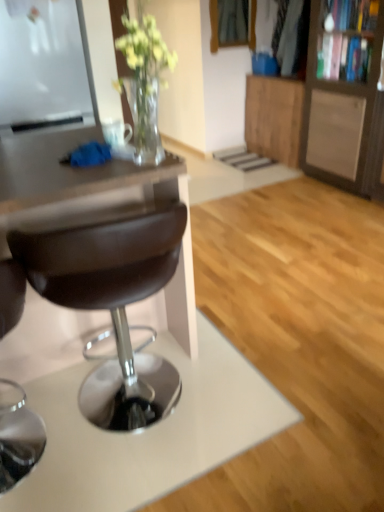
Question: Can you confirm if wooden cabinet at right, arranged as the 1th cabinetry when viewed from the front, is positioned to the right of wooden cabinet at upper right, placed as the second cabinetry when sorted from front to back?

Choices:
 (A) no
 (B) yes

Answer: (B)

Question: Is wooden cabinet at right, which appears as the 2th cabinetry when viewed from the back, shorter than wooden cabinet at upper right, placed as the second cabinetry when sorted from front to back?

Choices:
 (A) no
 (B) yes

Answer: (A)

Question: Is the depth of wooden cabinet at right, arranged as the 1th cabinetry when viewed from the front, greater than that of wooden cabinet at upper right, placed as the second cabinetry when sorted from front to back?

Choices:
 (A) no
 (B) yes

Answer: (A)

Question: Does wooden cabinet at right, arranged as the 1th cabinetry when viewed from the front, have a smaller size compared to wooden cabinet at upper right, placed as the second cabinetry when sorted from front to back?

Choices:
 (A) no
 (B) yes

Answer: (A)

Question: Is wooden cabinet at right, which appears as the 2th cabinetry when viewed from the back, not inside wooden cabinet at upper right, positioned as the 1th cabinetry in back-to-front order?

Choices:
 (A) yes
 (B) no

Answer: (A)

Question: Is brown leather stool at center spatially inside brown leather desk at left, or outside of it?

Choices:
 (A) inside
 (B) outside

Answer: (A)

Question: From the image's perspective, relative to brown leather desk at left, is brown leather stool at center above or below?

Choices:
 (A) above
 (B) below

Answer: (B)

Question: From a real-world perspective, is brown leather stool at center positioned above or below brown leather desk at left?

Choices:
 (A) above
 (B) below

Answer: (B)

Question: In terms of width, does brown leather stool at center look wider or thinner when compared to brown leather desk at left?

Choices:
 (A) thin
 (B) wide

Answer: (A)

Question: Considering the positions of point click(x=59, y=152) and point click(x=367, y=14), is point click(x=59, y=152) closer or farther from the camera than point click(x=367, y=14)?

Choices:
 (A) closer
 (B) farther

Answer: (A)

Question: In terms of size, does brown leather desk at left appear bigger or smaller than wooden cabinet at right, which appears as the 2th cabinetry when viewed from the back?

Choices:
 (A) big
 (B) small

Answer: (A)

Question: From the image's perspective, is brown leather desk at left located above or below wooden cabinet at right, which appears as the 2th cabinetry when viewed from the back?

Choices:
 (A) above
 (B) below

Answer: (B)

Question: Considering the positions of brown leather desk at left and wooden cabinet at right, arranged as the 1th cabinetry when viewed from the front, in the image, is brown leather desk at left wider or thinner than wooden cabinet at right, arranged as the 1th cabinetry when viewed from the front,?

Choices:
 (A) wide
 (B) thin

Answer: (A)

Question: Is wooden cabinet at right, which appears as the 2th cabinetry when viewed from the back, in front of or behind brown leather stool at center in the image?

Choices:
 (A) front
 (B) behind

Answer: (B)

Question: From a real-world perspective, is wooden cabinet at right, arranged as the 1th cabinetry when viewed from the front, physically located above or below brown leather stool at center?

Choices:
 (A) above
 (B) below

Answer: (A)